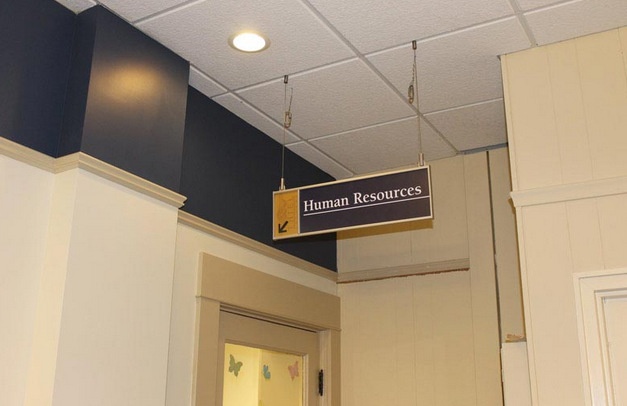
Find the location of a particular element. dark accent painted wall is located at coordinates (45, 100), (129, 110), (216, 152).